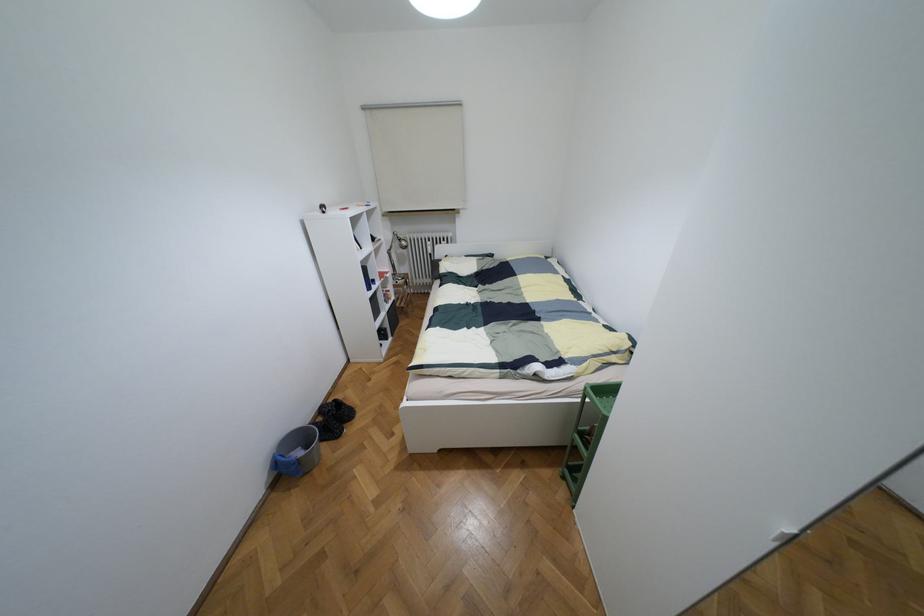
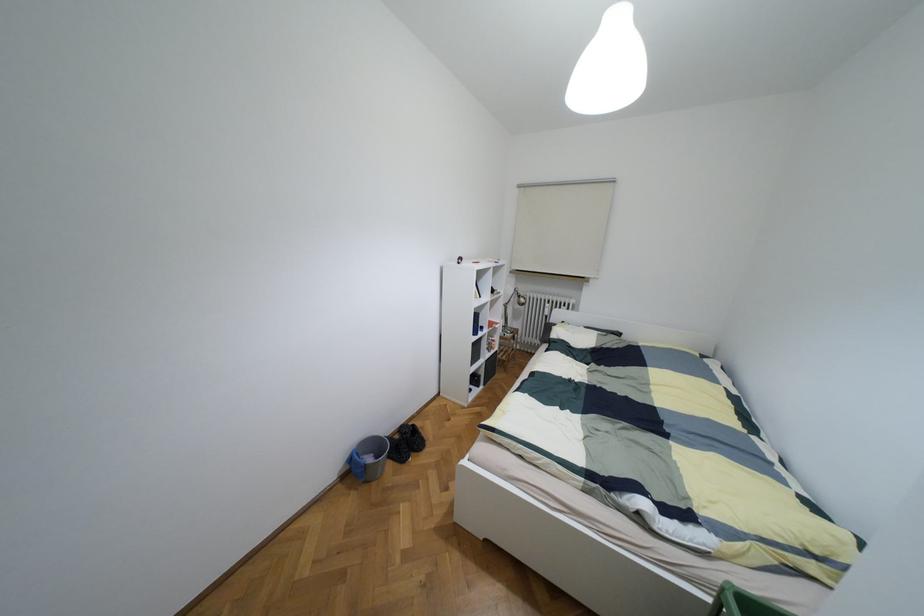
Find the pixel in the second image that matches point (298, 453) in the first image.

(369, 459)